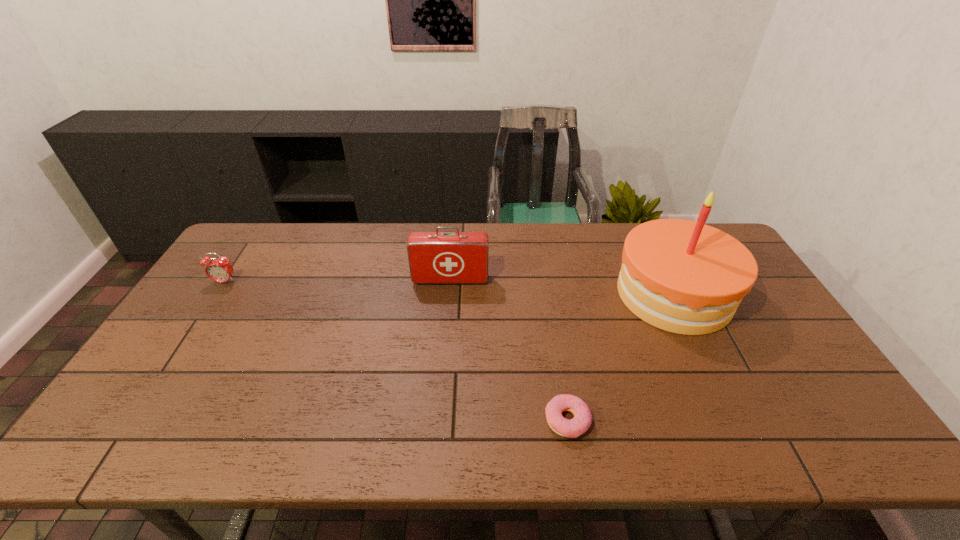
Locate an element on the screen. the rightmost object is located at coordinates (685, 277).

Where is `the tallest object`? This screenshot has width=960, height=540. the tallest object is located at coordinates (685, 277).

At what (x,y) coordinates should I click in order to perform the action: click on the first-aid kit. Please return your answer as a coordinate pair (x, y). This screenshot has width=960, height=540. Looking at the image, I should click on click(x=436, y=257).

Where is `the third object from right to left`? The width and height of the screenshot is (960, 540). the third object from right to left is located at coordinates (436, 257).

What are the coordinates of `alarm clock` in the screenshot? It's located at (219, 270).

Locate an element on the screen. This screenshot has height=540, width=960. the third tallest object is located at coordinates (219, 270).

Identify the location of the shortest object. This screenshot has height=540, width=960. tap(582, 420).

Locate an element on the screen. This screenshot has width=960, height=540. doughnut is located at coordinates (582, 420).

You are a GUI agent. You are given a task and a screenshot of the screen. Output one action in this format:
    pyautogui.click(x=<x>, y=<y>)
    Task: Click on the vacant region located on the front of the birthday cake
    This screenshot has height=540, width=960.
    Given the screenshot: What is the action you would take?
    pyautogui.click(x=750, y=452)

Locate an element on the screen. free space located 0.090m on the side of the third shortest object with the first aid cross symbol is located at coordinates (448, 306).